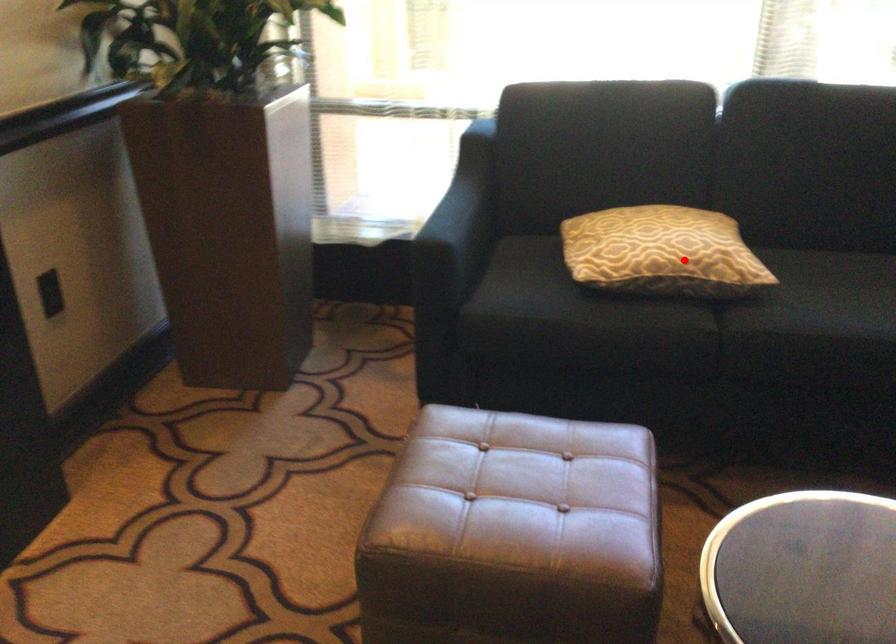
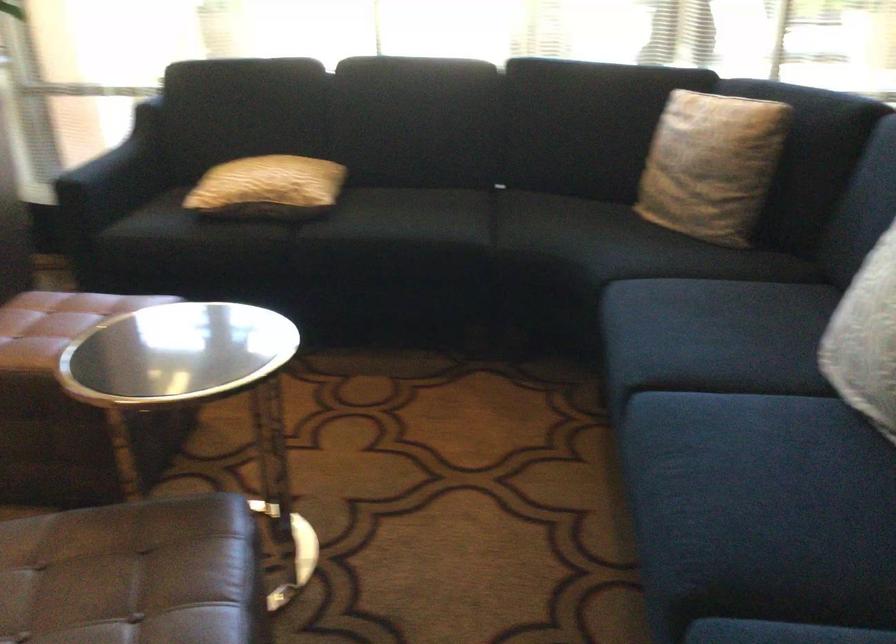
Question: A red point is marked in image1. In image2, is the corresponding 3D point closer to the camera or farther? Reply with the corresponding letter.

Choices:
 (A) The corresponding 3D point is closer.
 (B) The corresponding 3D point is farther.

Answer: (B)